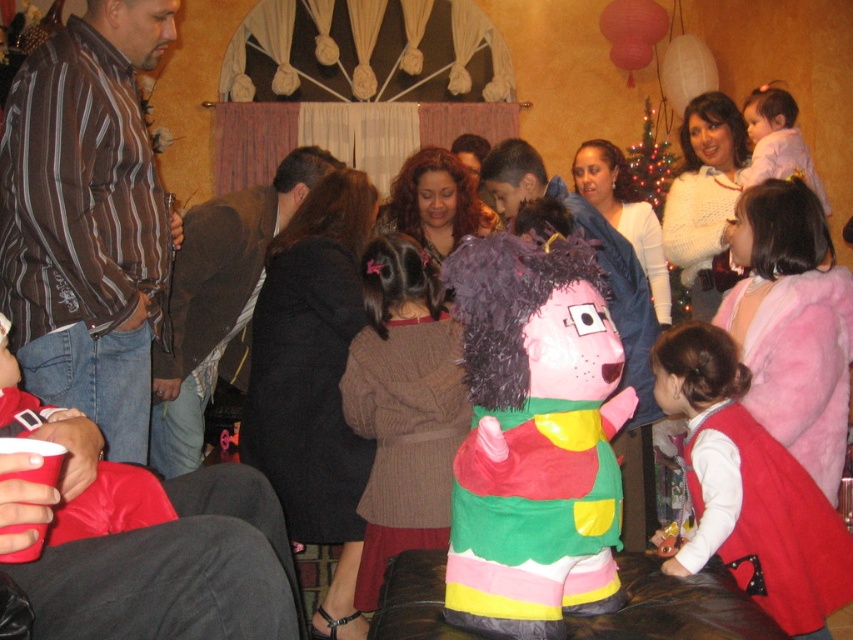
You are a guest at the party and want to take a photo of both the plush pink pinata at center and the brown knitted dress at center. Which object should you focus on first to ensure both are in the frame?

You should focus on the plush pink pinata at center first since it is closer to you than the brown knitted dress at center, ensuring both are in the frame.

You are organizing a party and need to decide which item to place in a narrow display case that can only accommodate items up to 10 inches in width. You have the plush pink pinata at center and the brown knitted dress at center. Based on their dimensions, which item would fit better in the display case?

The plush pink pinata at center is thinner than the brown knitted dress at center, so it would fit better in the narrow display case.

You are a guest at the party and want to choose an outfit to wear. You see both the black wool dress at center and the dark brown coat at center. Which one is shorter in length?

The black wool dress at center is shorter than the dark brown coat at center.